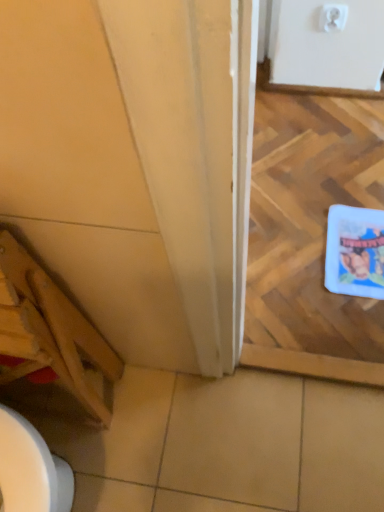
At what (x,y) coordinates should I click in order to perform the action: click on wooden chair at lower left. Please return your answer as a coordinate pair (x, y). This screenshot has width=384, height=512. Looking at the image, I should click on (50, 332).

This screenshot has width=384, height=512. Describe the element at coordinates (50, 332) in the screenshot. I see `wooden chair at lower left` at that location.

What is the approximate height of wooden chair at lower left?

It is 30.33 inches.

Locate an element on the screen. The width and height of the screenshot is (384, 512). wooden chair at lower left is located at coordinates (50, 332).